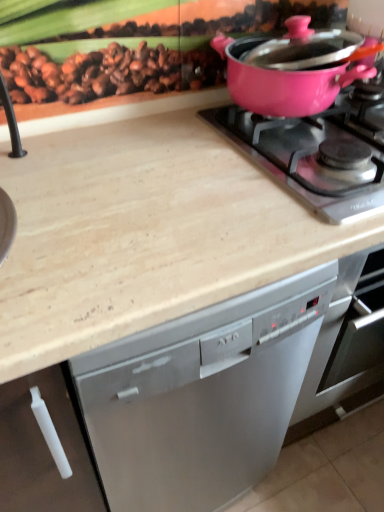
What do you see at coordinates (143, 228) in the screenshot? The height and width of the screenshot is (512, 384). I see `beige marble countertop at upper center` at bounding box center [143, 228].

The image size is (384, 512). Describe the element at coordinates (285, 85) in the screenshot. I see `pink glossy pot at upper right` at that location.

Identify the location of pink glossy pot at upper right. (306, 158).

Where is `beige marble countertop at upper center`? beige marble countertop at upper center is located at coordinates (143, 228).

Would you say pink glossy pot at upper right is to the left or to the right of pink glossy pot at upper right in the picture?

In the image, pink glossy pot at upper right appears on the left side of pink glossy pot at upper right.

Can you tell me how much pink glossy pot at upper right and pink glossy pot at upper right differ in facing direction?

0.000726 degrees.

From a real-world perspective, relative to pink glossy pot at upper right, is pink glossy pot at upper right vertically above or below?

From a real-world perspective, pink glossy pot at upper right is physically above pink glossy pot at upper right.

What are the coordinates of `kitchen appliance above the pink glossy pot at upper right (from the image's perspective)` in the screenshot? It's located at (285, 85).

Which is less distant, (293, 78) or (136, 123)?

Point (293, 78) is closer to the camera than point (136, 123).

At what (x,y) coordinates should I click in order to perform the action: click on countertop to the left of pink glossy pot at upper right. Please return your answer as a coordinate pair (x, y). The width and height of the screenshot is (384, 512). Looking at the image, I should click on (143, 228).

How many degrees apart are the facing directions of pink glossy pot at upper right and beige marble countertop at upper center?

pink glossy pot at upper right and beige marble countertop at upper center are facing 0.000418 degrees away from each other.

Is pink glossy pot at upper right to the left of beige marble countertop at upper center from the viewer's perspective?

No.

Which of these two, pink glossy pot at upper right or beige marble countertop at upper center, stands taller?

beige marble countertop at upper center.

From the image's perspective, which object appears higher, pink glossy pot at upper right or beige marble countertop at upper center?

From the image's view, pink glossy pot at upper right is above.

Looking at this image, is pink glossy pot at upper right at the left side of beige marble countertop at upper center?

No, pink glossy pot at upper right is not to the left of beige marble countertop at upper center.

Would you say beige marble countertop at upper center is outside pink glossy pot at upper right?

beige marble countertop at upper center is positioned outside pink glossy pot at upper right.

From the image's perspective, which object appears higher, beige marble countertop at upper center or pink glossy pot at upper right?

pink glossy pot at upper right appears higher in the image.

From the picture: Is beige marble countertop at upper center turned away from pink glossy pot at upper right?

beige marble countertop at upper center does not have its back to pink glossy pot at upper right.

Is pink glossy pot at upper right situated inside pink glossy pot at upper right or outside?

pink glossy pot at upper right lies outside pink glossy pot at upper right.

Is pink glossy pot at upper right in front of or behind pink glossy pot at upper right in the image?

In the image, pink glossy pot at upper right appears in front of pink glossy pot at upper right.

I want to click on gas stove below the pink glossy pot at upper right (from a real-world perspective), so click(306, 158).

Considering the sizes of objects beige marble countertop at upper center and pink glossy pot at upper right in the image provided, who is taller, beige marble countertop at upper center or pink glossy pot at upper right?

With more height is beige marble countertop at upper center.

Who is more distant, beige marble countertop at upper center or pink glossy pot at upper right?

pink glossy pot at upper right is further from the camera.

In the scene shown: Visually, is beige marble countertop at upper center positioned to the left or to the right of pink glossy pot at upper right?

In the image, beige marble countertop at upper center appears on the left side of pink glossy pot at upper right.

Can you see beige marble countertop at upper center touching pink glossy pot at upper right?

No, beige marble countertop at upper center is not making contact with pink glossy pot at upper right.

You are a GUI agent. You are given a task and a screenshot of the screen. Output one action in this format:
    pyautogui.click(x=<x>, y=<y>)
    Task: Click on the gas stove beneath the pink glossy pot at upper right (from a real-world perspective)
    Image resolution: width=384 pixels, height=512 pixels.
    Given the screenshot: What is the action you would take?
    pyautogui.click(x=306, y=158)

Locate an element on the screen. countertop below the pink glossy pot at upper right (from the image's perspective) is located at coordinates (143, 228).

Which object lies nearer to the anchor point pink glossy pot at upper right, pink glossy pot at upper right or beige marble countertop at upper center?

pink glossy pot at upper right is positioned closer to the anchor pink glossy pot at upper right.

Considering their positions, is beige marble countertop at upper center positioned closer to pink glossy pot at upper right than pink glossy pot at upper right?

Based on the image, pink glossy pot at upper right appears to be nearer to pink glossy pot at upper right.

Estimate the real-world distances between objects in this image. Which object is further from beige marble countertop at upper center, pink glossy pot at upper right or pink glossy pot at upper right?

Based on the image, pink glossy pot at upper right appears to be further to beige marble countertop at upper center.

From the image, which object appears to be farther from pink glossy pot at upper right, pink glossy pot at upper right or beige marble countertop at upper center?

beige marble countertop at upper center is positioned further to the anchor pink glossy pot at upper right.

When comparing their distances from pink glossy pot at upper right, does beige marble countertop at upper center or pink glossy pot at upper right seem closer?

The object closer to pink glossy pot at upper right is pink glossy pot at upper right.

From the image, which object appears to be farther from beige marble countertop at upper center, pink glossy pot at upper right or pink glossy pot at upper right?

pink glossy pot at upper right lies further to beige marble countertop at upper center than the other object.

Locate an element on the screen. The height and width of the screenshot is (512, 384). gas stove that lies between pink glossy pot at upper right and beige marble countertop at upper center from top to bottom is located at coordinates point(306,158).